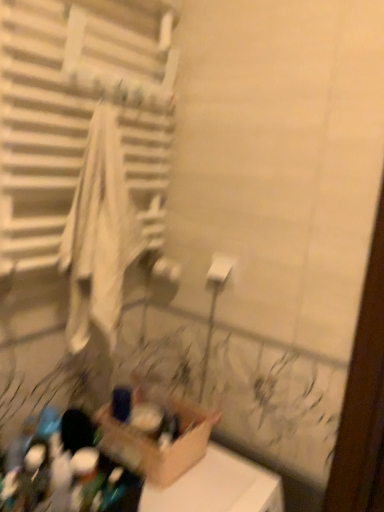
Question: Is cardboard box at lower center bigger or smaller than white matte toilet paper at center?

Choices:
 (A) small
 (B) big

Answer: (B)

Question: Is cardboard box at lower center in front of or behind white matte toilet paper at center in the image?

Choices:
 (A) front
 (B) behind

Answer: (A)

Question: Estimate the real-world distances between objects in this image. Which object is closer to the white fabric towel at left?

Choices:
 (A) white matte toilet paper at center
 (B) cardboard box at lower center

Answer: (A)

Question: Which of these objects is positioned closest to the white fabric towel at left?

Choices:
 (A) white matte toilet paper at center
 (B) cardboard box at lower center

Answer: (A)